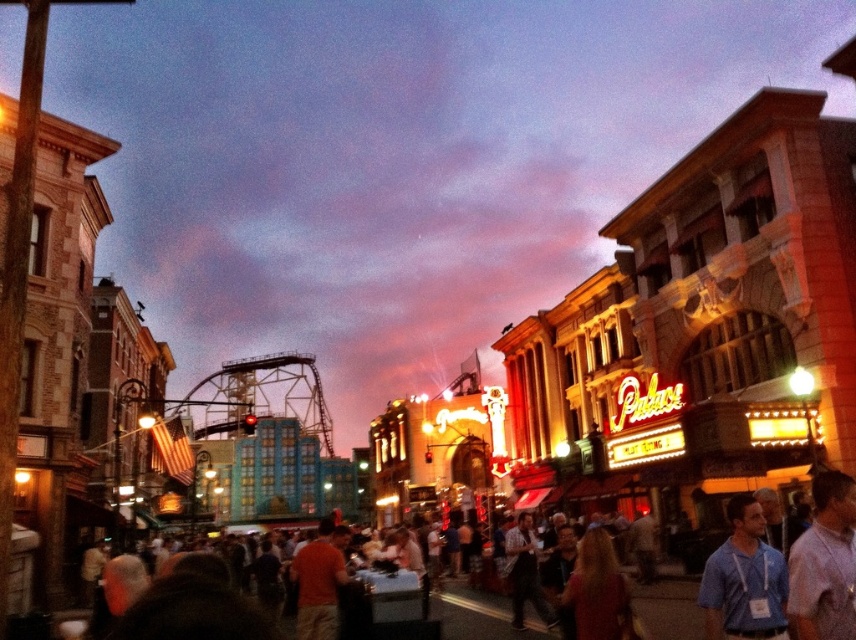
You are a photographer standing in the themed entertainment area and want to capture a photo of the blue fabric shirt at center without the human skin textured crowd at center appearing in the foreground. Is this possible based on their positions?

The human skin textured crowd at center is behind the blue fabric shirt at center, so yes, you can take a photo of the blue fabric shirt at center without the crowd in the foreground by focusing on the shirt and ensuring the crowd is out of the frame behind it.

You are a photographer standing at the edge of the themed entertainment area. You want to capture a photo of the blue fabric shirt at center and the human skin textured crowd at center. Based on their sizes, which object would appear smaller in the photo?

The blue fabric shirt at center would appear smaller in the photo because its width is less than the human skin textured crowd at center.